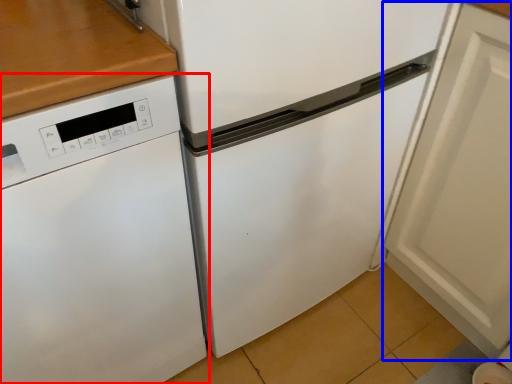
Question: Which point is further to the camera, home appliance (highlighted by a red box) or door (highlighted by a blue box)?

Choices:
 (A) home appliance
 (B) door

Answer: (B)